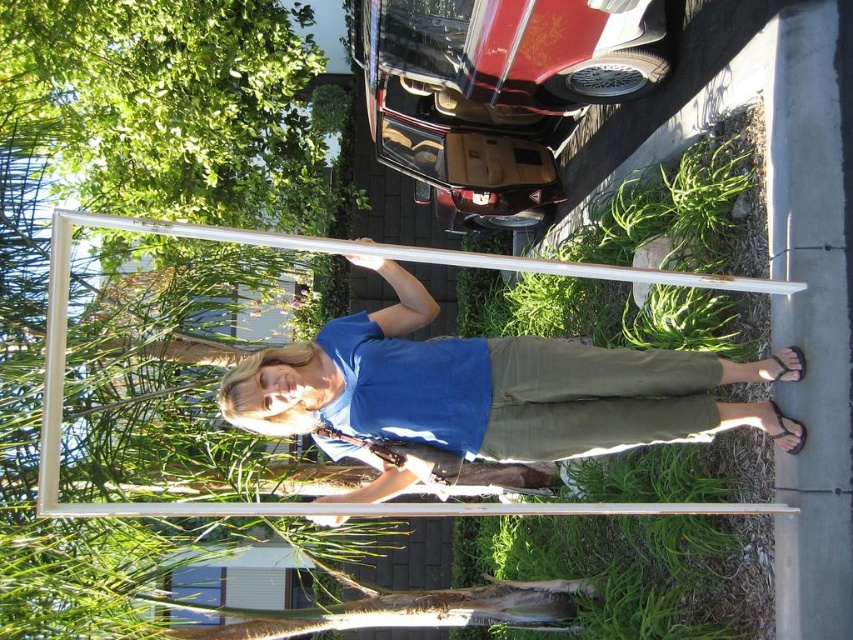
Question: Does matte white surfboard at center have a larger size compared to white matte pole at center?

Choices:
 (A) yes
 (B) no

Answer: (A)

Question: Which object appears closest to the camera in this image?

Choices:
 (A) white matte pole at center
 (B) matte white surfboard at center

Answer: (A)

Question: Does matte white surfboard at center have a larger size compared to white matte pole at center?

Choices:
 (A) yes
 (B) no

Answer: (A)

Question: Is matte white surfboard at center further to the viewer compared to white matte pole at center?

Choices:
 (A) yes
 (B) no

Answer: (A)

Question: Which object is closer to the camera taking this photo?

Choices:
 (A) matte white surfboard at center
 (B) white matte pole at center

Answer: (B)